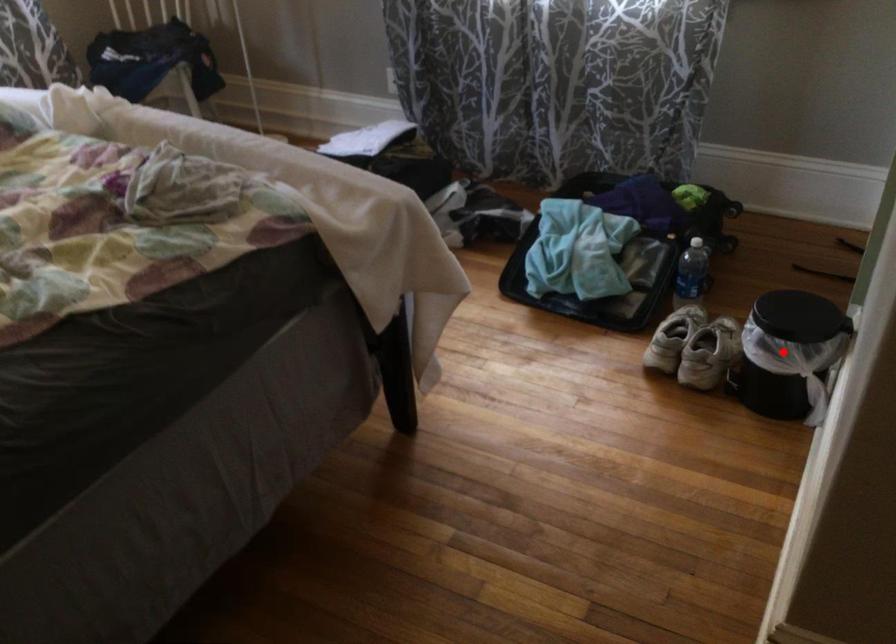
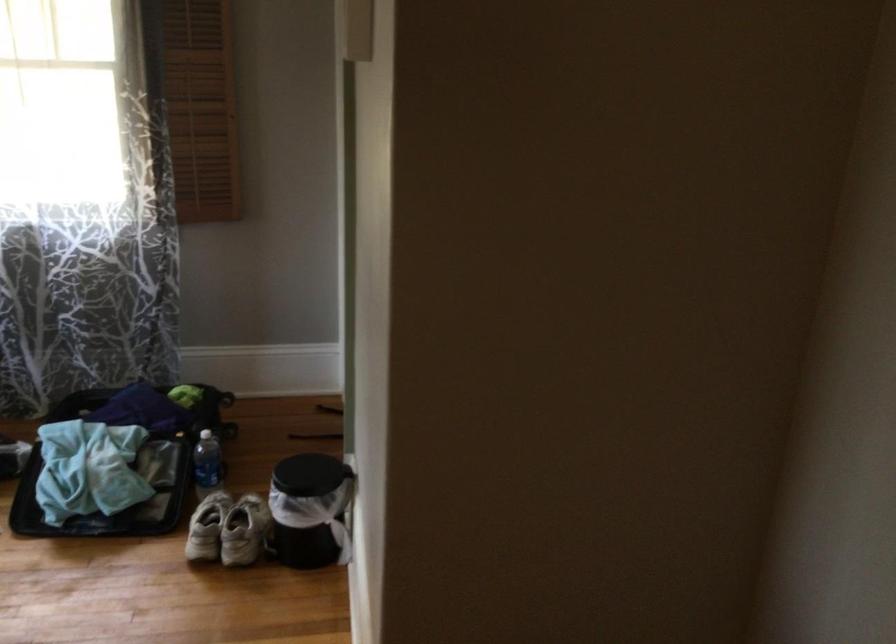
In the second image, find the point that corresponds to the highlighted location in the first image.

(309, 509)